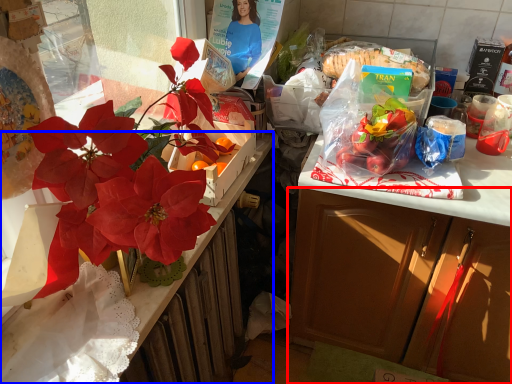
Question: Among these objects, which one is nearest to the camera, cabinetry (highlighted by a red box) or desk (highlighted by a blue box)?

Choices:
 (A) cabinetry
 (B) desk

Answer: (B)